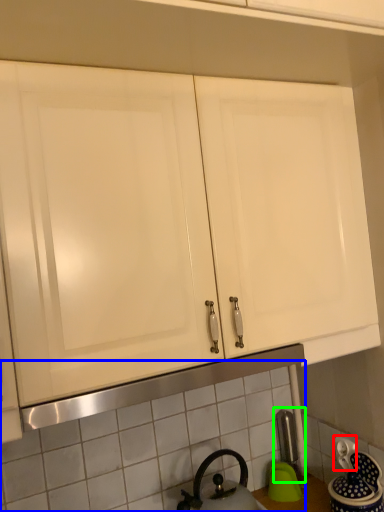
Question: Which object is positioned farthest from electric outlet (highlighted by a red box)? Select from tile (highlighted by a blue box) and faucet (highlighted by a green box).

Choices:
 (A) tile
 (B) faucet

Answer: (A)